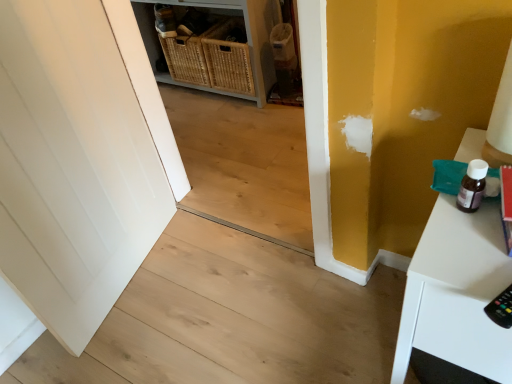
Question: Is white glossy table at right oriented towards natural wood stair at center?

Choices:
 (A) no
 (B) yes

Answer: (A)

Question: Is white glossy table at right not near natural wood stair at center?

Choices:
 (A) no
 (B) yes

Answer: (A)

Question: Is white glossy table at right to the right of natural wood stair at center from the viewer's perspective?

Choices:
 (A) yes
 (B) no

Answer: (A)

Question: From a real-world perspective, is white glossy table at right below natural wood stair at center?

Choices:
 (A) yes
 (B) no

Answer: (B)

Question: Can you confirm if white glossy table at right is thinner than natural wood stair at center?

Choices:
 (A) yes
 (B) no

Answer: (A)

Question: Does white glossy table at right come in front of natural wood stair at center?

Choices:
 (A) yes
 (B) no

Answer: (A)

Question: Is woven wicker baskets at center beside white glossy table at right?

Choices:
 (A) yes
 (B) no

Answer: (B)

Question: From a real-world perspective, is woven wicker baskets at center located higher than white glossy table at right?

Choices:
 (A) yes
 (B) no

Answer: (B)

Question: Considering the relative sizes of woven wicker baskets at center and white glossy table at right in the image provided, is woven wicker baskets at center bigger than white glossy table at right?

Choices:
 (A) yes
 (B) no

Answer: (A)

Question: Is woven wicker baskets at center facing towards white glossy table at right?

Choices:
 (A) no
 (B) yes

Answer: (A)

Question: Considering the relative positions of woven wicker baskets at center and white glossy table at right in the image provided, is woven wicker baskets at center to the right of white glossy table at right from the viewer's perspective?

Choices:
 (A) no
 (B) yes

Answer: (A)

Question: Can you confirm if woven wicker baskets at center is wider than white glossy table at right?

Choices:
 (A) yes
 (B) no

Answer: (B)

Question: Can you confirm if woven wicker baskets at center is thinner than natural wood stair at center?

Choices:
 (A) no
 (B) yes

Answer: (B)